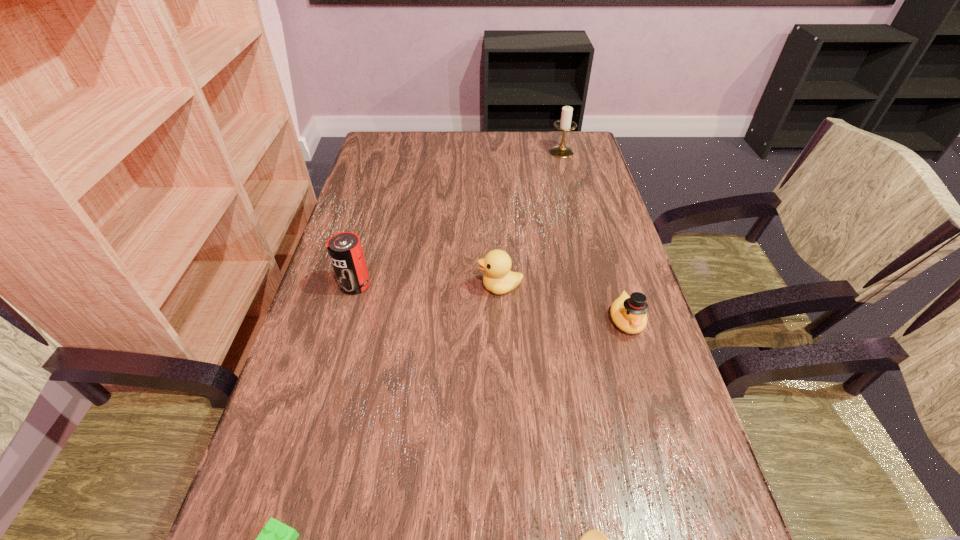
Where is `candle holder`? candle holder is located at coordinates (565, 124).

In order to click on the second tallest object in this screenshot , I will do `click(345, 250)`.

At what (x,y) coordinates should I click in order to perform the action: click on the farthest duck. Please return your answer as a coordinate pair (x, y). The height and width of the screenshot is (540, 960). Looking at the image, I should click on (498, 278).

What are the coordinates of `the fourth farthest object` in the screenshot? It's located at (628, 313).

This screenshot has height=540, width=960. I want to click on the second farthest duck, so [x=628, y=313].

You are a GUI agent. You are given a task and a screenshot of the screen. Output one action in this format:
    pyautogui.click(x=<x>, y=<y>)
    Task: Click on the vacant area located on the left of the candle holder
    
    Given the screenshot: What is the action you would take?
    pyautogui.click(x=474, y=152)

This screenshot has height=540, width=960. I want to click on free space located 0.130m on the right of the can, so click(423, 285).

Where is `vacant area located 0.280m on the face of the farthest duck`? The width and height of the screenshot is (960, 540). vacant area located 0.280m on the face of the farthest duck is located at coordinates (362, 287).

You are a GUI agent. You are given a task and a screenshot of the screen. Output one action in this format:
    pyautogui.click(x=<x>, y=<y>)
    Task: Click on the vacant space situated 0.310m on the face of the farthest duck
    This screenshot has width=960, height=540.
    Given the screenshot: What is the action you would take?
    pyautogui.click(x=349, y=287)

Find the location of `vacant space positioned on the face of the farthest duck`. vacant space positioned on the face of the farthest duck is located at coordinates (371, 287).